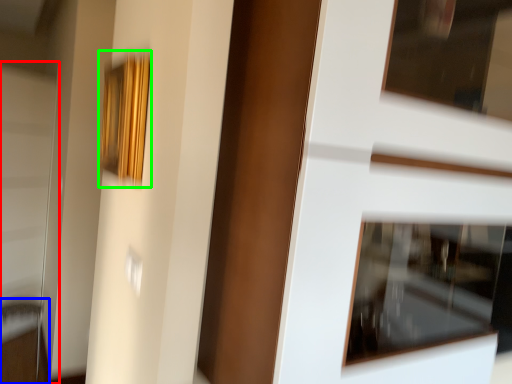
Question: Which is farther away from screen door (highlighted by a red box)? furniture (highlighted by a blue box) or picture frame (highlighted by a green box)?

Choices:
 (A) furniture
 (B) picture frame

Answer: (B)